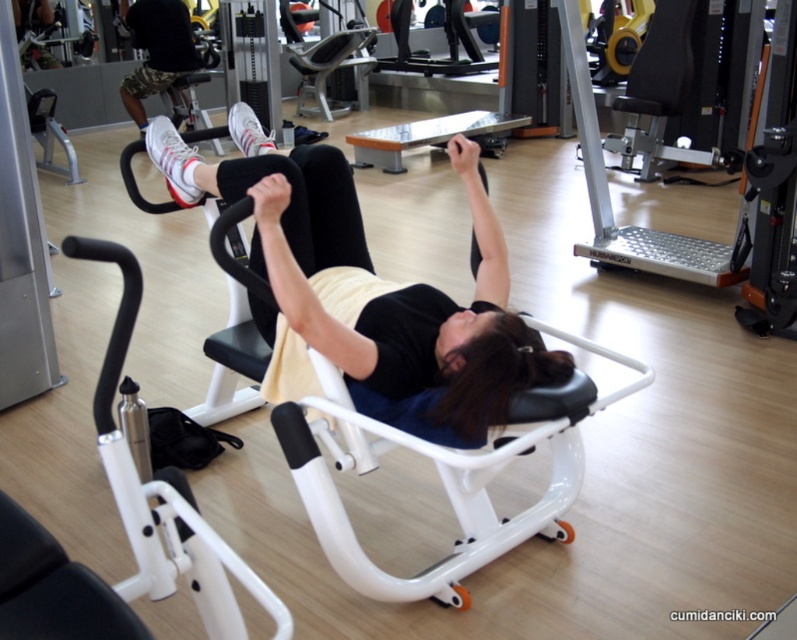
You are a gym trainer observing the scene. The client is using the black matte exercise machine at center and wearing the black camouflage shorts at upper left. Can you determine which object is closer to the observer in the image?

The black matte exercise machine at center is closer to the observer than the black camouflage shorts at upper left because it is positioned in front of it.

Looking at this image, you are a gym trainer who needs to move a 3.5 meter long equipment from the entrance to the area near the black matte exercise machine at center. The entrance is located near the black camouflage shorts at upper left. Is there enough space to maneuver the equipment without bending it?

The distance between the black matte exercise machine at center and the black camouflage shorts at upper left is 4.81 meters. Since the equipment is 3.5 meters long, there is sufficient space to maneuver it without bending, as the distance is greater than the equipment length.

Based on the photo, you are a fitness trainer assessing a client in a gym. The client is using a machine for upper body workouts. You notice a point at coordinates point [320,337]. If the camera is positioned at the entrance of the gym, can the client reach that point without moving from the machine?

The point [320,337] is 6.19 feet away from the camera. Since the client is on the machine and likely cannot move far from it, they probably cannot reach the point unless it is within their immediate vicinity. However, the distance given is from the camera, not the client, so without knowing the client s exact position relative to the camera, it s hard to determine. But based on typical gym layouts, if the camera is at the entrance and the machine is near the center, 6.19 feet might be reachable if the ,